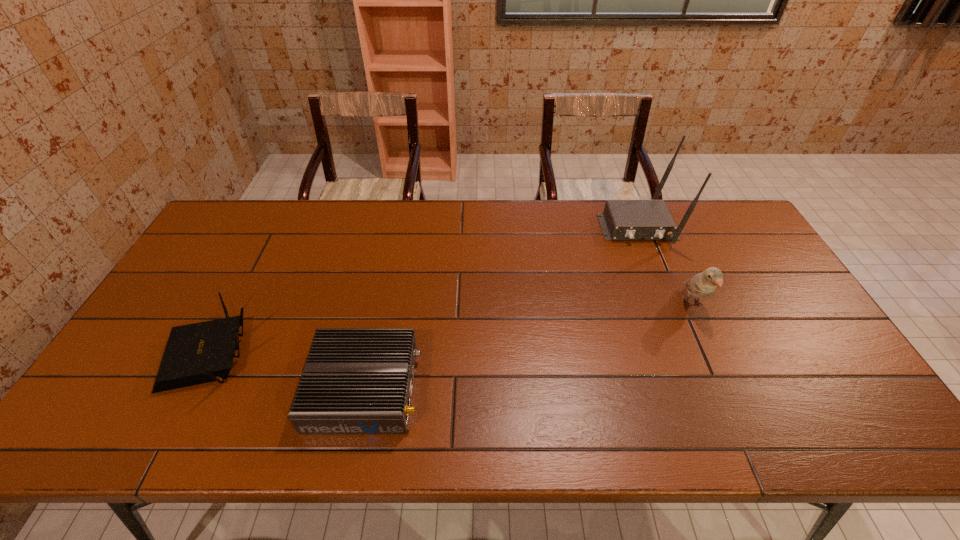
Identify the location of free spot between the second object from left to right and the bird. (528, 347).

Image resolution: width=960 pixels, height=540 pixels. I want to click on unoccupied area between the shortest object and the second tallest router, so click(286, 371).

I want to click on free space between the third object from right to left and the tallest router, so click(x=500, y=308).

This screenshot has width=960, height=540. What are the coordinates of `vacant point located between the third shortest object and the second tallest router` in the screenshot? It's located at click(450, 329).

This screenshot has height=540, width=960. What are the coordinates of `free space between the shortest router and the bird` in the screenshot? It's located at (528, 347).

Locate an element on the screen. free spot between the farthest object and the second router from right to left is located at coordinates (500, 308).

Identify the location of free space that is in between the bird and the leftmost object. The width and height of the screenshot is (960, 540). (450, 329).

At what (x,y) coordinates should I click in order to perform the action: click on free space that is in between the third tallest object and the bird. Please return your answer as a coordinate pair (x, y). The width and height of the screenshot is (960, 540). Looking at the image, I should click on (450, 329).

In order to click on unoccupied position between the third shortest object and the tallest object in this screenshot , I will do `click(664, 266)`.

The image size is (960, 540). Identify the location of object that stands as the third closest to the bird. (198, 353).